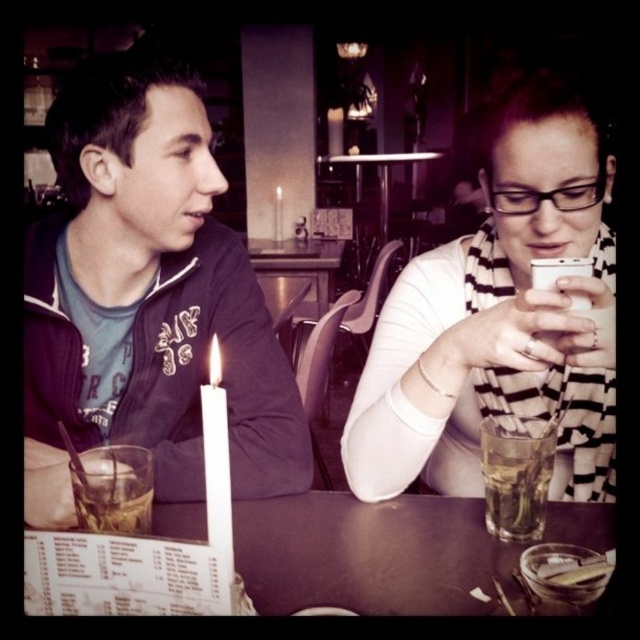
Is white paper menu at lower left thinner than white matte candle at left?

No, white paper menu at lower left is not thinner than white matte candle at left.

Which of these two, white paper menu at lower left or white matte candle at left, stands taller?

With more height is white matte candle at left.

The width and height of the screenshot is (640, 640). Describe the element at coordinates (369, 554) in the screenshot. I see `white paper menu at lower left` at that location.

You are a GUI agent. You are given a task and a screenshot of the screen. Output one action in this format:
    pyautogui.click(x=<x>, y=<y>)
    Task: Click on the white paper menu at lower left
    
    Given the screenshot: What is the action you would take?
    pyautogui.click(x=369, y=554)

Does matte black jacket at left appear on the left side of white wax candle at center?

Incorrect, matte black jacket at left is not on the left side of white wax candle at center.

Between matte black jacket at left and white wax candle at center, which one is positioned lower?

matte black jacket at left is below.

What do you see at coordinates (147, 298) in the screenshot? This screenshot has height=640, width=640. I see `matte black jacket at left` at bounding box center [147, 298].

I want to click on matte black jacket at left, so click(147, 298).

Does point (358, 396) come behind point (492, 449)?

Yes, point (358, 396) is farther from viewer.

Does matte black jacket at center have a greater height compared to clear glass at table right?

Yes.

Identify the location of matte black jacket at center. (499, 317).